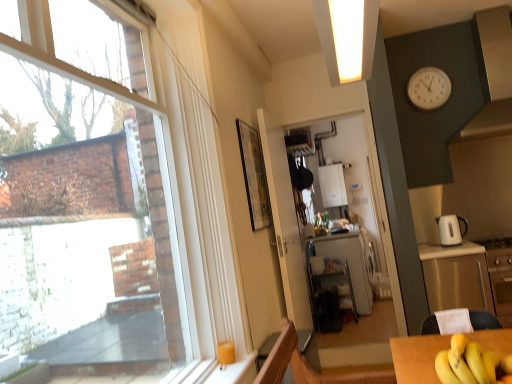
Question: In terms of height, does white glossy electric kettle at right look taller or shorter compared to white glossy boiler at center?

Choices:
 (A) short
 (B) tall

Answer: (A)

Question: Considering their positions, is white glossy electric kettle at right located in front of or behind white glossy boiler at center?

Choices:
 (A) front
 (B) behind

Answer: (A)

Question: Considering the real-world distances, which object is closest to the white glossy electric kettle at right?

Choices:
 (A) white glossy exhaust hood at upper right
 (B) matte yellow cup at lower left
 (C) stainless steel cabinet at right
 (D) wooden framed artwork at center
 (E) white glossy refrigerator at center

Answer: (C)

Question: Which object is positioned closest to the white glossy exhaust hood at upper right?

Choices:
 (A) white glossy refrigerator at center
 (B) yellow matte bananas at lower right
 (C) transparent glass window at upper left
 (D) white plastic clock at upper right
 (E) matte yellow cup at lower left

Answer: (D)